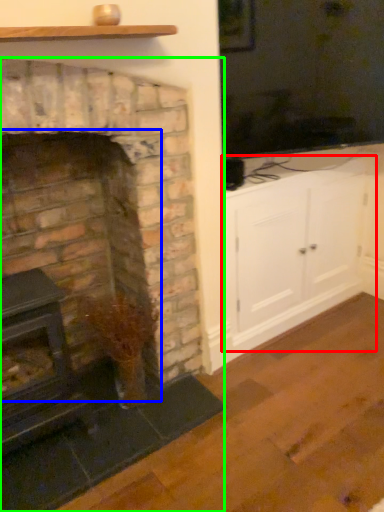
Question: Considering the real-world distances, which object is closest to entertainment center (highlighted by a red box)? fireplace (highlighted by a blue box) or fireplace (highlighted by a green box).

Choices:
 (A) fireplace
 (B) fireplace

Answer: (B)